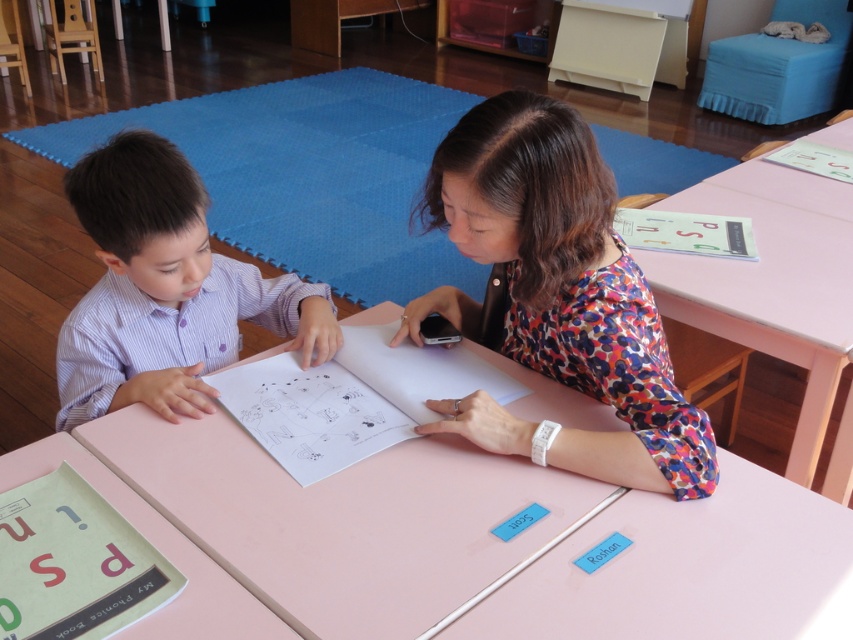
Question: Which point appears farthest from the camera in this image?

Choices:
 (A) (590, 310)
 (B) (432, 442)

Answer: (B)

Question: Does floral fabric blouse at center have a greater width compared to purple striped shirt at left?

Choices:
 (A) no
 (B) yes

Answer: (A)

Question: Observing the image, what is the correct spatial positioning of pink wood table at center in reference to pink wood table at upper right?

Choices:
 (A) right
 (B) left

Answer: (B)

Question: Which of these objects is positioned closest to the pink wood table at upper right?

Choices:
 (A) purple striped shirt at left
 (B) pink wood table at center
 (C) floral fabric blouse at center

Answer: (C)

Question: Does floral fabric blouse at center lie behind purple striped shirt at left?

Choices:
 (A) no
 (B) yes

Answer: (A)

Question: Which point appears farthest from the camera in this image?

Choices:
 (A) (283, 310)
 (B) (366, 522)
 (C) (801, 257)

Answer: (C)